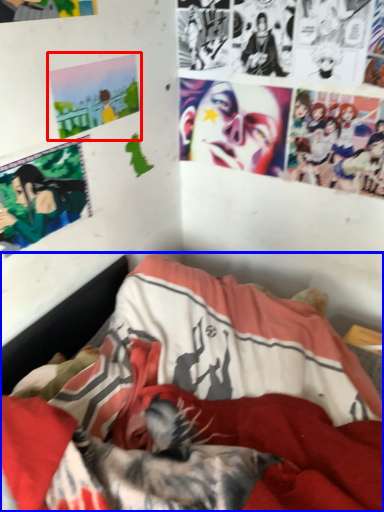
Question: Which point is closer to the camera, poster page (highlighted by a red box) or bed (highlighted by a blue box)?

Choices:
 (A) poster page
 (B) bed

Answer: (B)